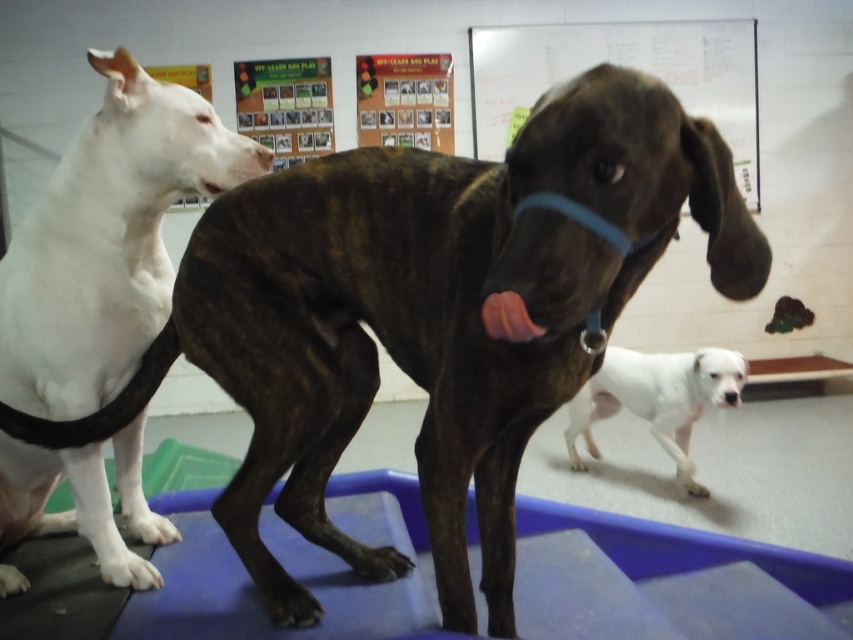
Question: Which of the following is the closest to the observer?

Choices:
 (A) white smooth dog at left
 (B) white smooth dog at lower right
 (C) whiteboard at upper center

Answer: (A)

Question: Does whiteboard at upper center appear on the right side of white smooth dog at lower right?

Choices:
 (A) yes
 (B) no

Answer: (A)

Question: Which object is the closest to the whiteboard at upper center?

Choices:
 (A) white smooth dog at left
 (B) white smooth dog at lower right

Answer: (B)

Question: Is white smooth dog at left bigger than whiteboard at upper center?

Choices:
 (A) yes
 (B) no

Answer: (B)

Question: Among these points, which one is farthest from the camera?

Choices:
 (A) (474, 67)
 (B) (634, 381)
 (C) (158, 125)

Answer: (A)

Question: Can you confirm if whiteboard at upper center is wider than white smooth dog at lower right?

Choices:
 (A) no
 (B) yes

Answer: (B)